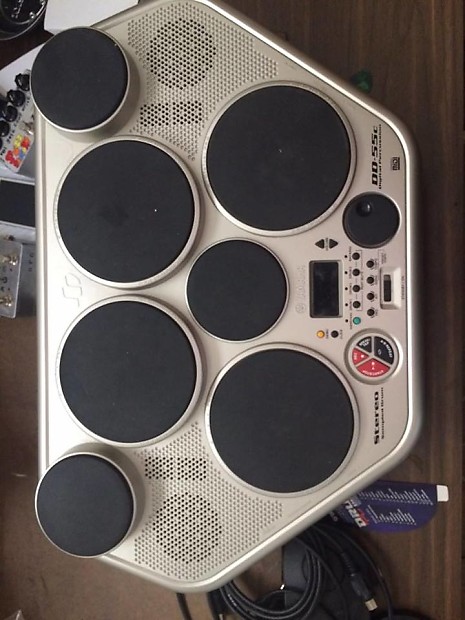
Locate an element on the screen. The width and height of the screenshot is (465, 620). small black knobs is located at coordinates [x=0, y=139], [x=19, y=77], [x=15, y=93], [x=11, y=112], [x=4, y=134].